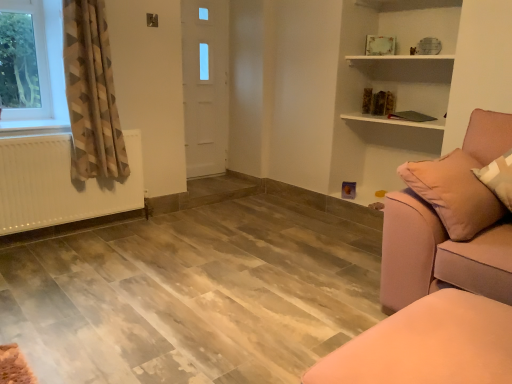
Where is `geometric-patterned fabric curtain at left`? This screenshot has width=512, height=384. geometric-patterned fabric curtain at left is located at coordinates (91, 93).

Image resolution: width=512 pixels, height=384 pixels. Identify the location of pink fabric ottoman at lower right. (428, 345).

The width and height of the screenshot is (512, 384). What do you see at coordinates (60, 184) in the screenshot?
I see `white matte radiator at left` at bounding box center [60, 184].

Measure the distance between point (507, 362) and camera.

The depth of point (507, 362) is 1.11 meters.

Locate an element on the screen. This screenshot has height=384, width=512. geometric-patterned fabric curtain at left is located at coordinates (91, 93).

Looking at this image, from their relative heights in the image, would you say satin pink couch at right is taller or shorter than pink fabric ottoman at lower right?

In the image, satin pink couch at right appears to be taller than pink fabric ottoman at lower right.

Is satin pink couch at right wider than pink fabric ottoman at lower right?

Yes, satin pink couch at right is wider than pink fabric ottoman at lower right.

How distant is satin pink couch at right from pink fabric ottoman at lower right?

satin pink couch at right and pink fabric ottoman at lower right are 22.92 inches apart.

Based on the photo, from the image's perspective, which is below, satin pink couch at right or pink fabric ottoman at lower right?

pink fabric ottoman at lower right, from the image's perspective.

Is white matte radiator at left positioned with its back to pink fabric ottoman at lower right?

No, pink fabric ottoman at lower right is not at the back of white matte radiator at left.

Consider the image. Is white matte radiator at left not near pink fabric ottoman at lower right?

Yes.

Looking at this image, is white matte radiator at left situated inside pink fabric ottoman at lower right or outside?

white matte radiator at left is not enclosed by pink fabric ottoman at lower right.

From a real-world perspective, is white matte radiator at left above or below pink fabric ottoman at lower right?

Clearly, from a real-world perspective, white matte radiator at left is above pink fabric ottoman at lower right.

Is pink fabric ottoman at lower right at the right side of satin pink couch at right?

In fact, pink fabric ottoman at lower right is to the left of satin pink couch at right.

Is pink fabric ottoman at lower right behind satin pink couch at right?

No, pink fabric ottoman at lower right is closer to the camera.

From the image's perspective, is pink fabric ottoman at lower right located above or below satin pink couch at right?

From the image's perspective, pink fabric ottoman at lower right appears below satin pink couch at right.

Is pink fabric ottoman at lower right inside the boundaries of satin pink couch at right, or outside?

pink fabric ottoman at lower right is located beyond the bounds of satin pink couch at right.

Between geometric-patterned fabric curtain at left and white matte radiator at left, which one has larger width?

Wider between the two is geometric-patterned fabric curtain at left.

From a real-world perspective, which object rests below the other?

white matte radiator at left, from a real-world perspective.

Considering the relative sizes of geometric-patterned fabric curtain at left and white matte radiator at left in the image provided, is geometric-patterned fabric curtain at left shorter than white matte radiator at left?

No.

The width and height of the screenshot is (512, 384). Identify the location of curtain on the right of white matte radiator at left. (91, 93).

Which of these two, pink fabric ottoman at lower right or white matte radiator at left, stands shorter?

With less height is pink fabric ottoman at lower right.

Choose the correct answer: Is pink fabric ottoman at lower right inside white matte radiator at left or outside it?

pink fabric ottoman at lower right is not enclosed by white matte radiator at left.

The height and width of the screenshot is (384, 512). I want to click on furniture in front of the white matte radiator at left, so click(x=428, y=345).

Is pink fabric ottoman at lower right looking in the opposite direction of white matte radiator at left?

No, pink fabric ottoman at lower right is not facing away from white matte radiator at left.

Can geometric-patterned fabric curtain at left be found inside pink fabric ottoman at lower right?

No.

Is pink fabric ottoman at lower right shorter than geometric-patterned fabric curtain at left?

Indeed, pink fabric ottoman at lower right has a lesser height compared to geometric-patterned fabric curtain at left.

Which is behind, pink fabric ottoman at lower right or geometric-patterned fabric curtain at left?

geometric-patterned fabric curtain at left is behind.

Which is further, (83, 142) or (401, 355)?

The point (83, 142) is farther.

Which is more to the left, geometric-patterned fabric curtain at left or satin pink couch at right?

geometric-patterned fabric curtain at left.

Looking at their sizes, would you say geometric-patterned fabric curtain at left is wider or thinner than satin pink couch at right?

Considering their sizes, geometric-patterned fabric curtain at left looks slimmer than satin pink couch at right.

Identify the location of furniture below the satin pink couch at right (from a real-world perspective). (428, 345).

Image resolution: width=512 pixels, height=384 pixels. I want to click on furniture below the white matte radiator at left (from the image's perspective), so click(x=428, y=345).

When comparing their distances from satin pink couch at right, does pink fabric ottoman at lower right or geometric-patterned fabric curtain at left seem closer?

The object closer to satin pink couch at right is pink fabric ottoman at lower right.

When comparing their distances from pink fabric ottoman at lower right, does satin pink couch at right or white matte radiator at left seem further?

white matte radiator at left.

Looking at the image, which one is located closer to pink fabric ottoman at lower right, geometric-patterned fabric curtain at left or white matte radiator at left?

The object closer to pink fabric ottoman at lower right is geometric-patterned fabric curtain at left.

When comparing their distances from pink fabric ottoman at lower right, does satin pink couch at right or geometric-patterned fabric curtain at left seem further?

Based on the image, geometric-patterned fabric curtain at left appears to be further to pink fabric ottoman at lower right.

Which object lies nearer to the anchor point pink fabric ottoman at lower right, geometric-patterned fabric curtain at left or satin pink couch at right?

Based on the image, satin pink couch at right appears to be nearer to pink fabric ottoman at lower right.

From the image, which object appears to be farther from white matte radiator at left, satin pink couch at right or geometric-patterned fabric curtain at left?

The object further to white matte radiator at left is satin pink couch at right.

Which object lies nearer to the anchor point satin pink couch at right, geometric-patterned fabric curtain at left or pink fabric ottoman at lower right?

pink fabric ottoman at lower right is closer to satin pink couch at right.

Which object lies further to the anchor point geometric-patterned fabric curtain at left, satin pink couch at right or pink fabric ottoman at lower right?

Among the two, pink fabric ottoman at lower right is located further to geometric-patterned fabric curtain at left.

This screenshot has width=512, height=384. Identify the location of curtain between white matte radiator at left and satin pink couch at right from left to right. (91, 93).

You are a GUI agent. You are given a task and a screenshot of the screen. Output one action in this format:
    pyautogui.click(x=<x>, y=<y>)
    Task: Click on the furniture situated between white matte radiator at left and satin pink couch at right from left to right
    
    Given the screenshot: What is the action you would take?
    pyautogui.click(x=428, y=345)

Identify the location of furniture between geometric-patterned fabric curtain at left and satin pink couch at right in the horizontal direction. (428, 345).

Where is `curtain between white matte radiator at left and pink fabric ottoman at lower right`? curtain between white matte radiator at left and pink fabric ottoman at lower right is located at coordinates (91, 93).